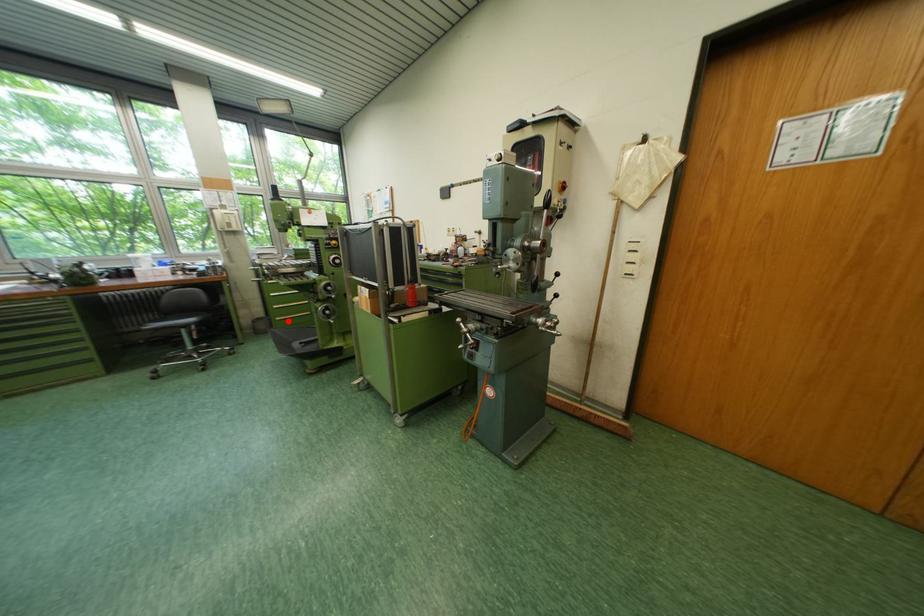
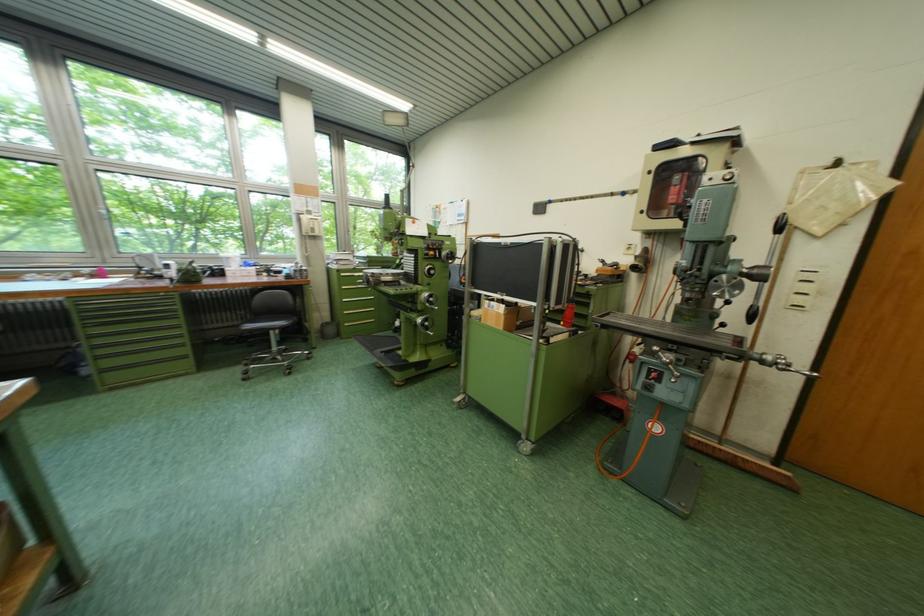
In the second image, find the point that corresponds to the highlighted location in the first image.

(357, 326)